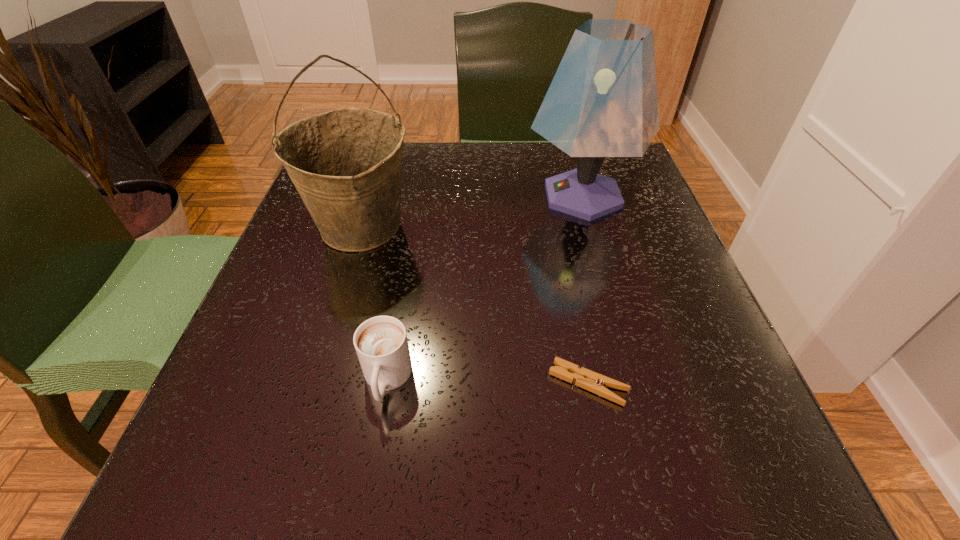
Where is `vacant area that satisfies the following two spatial constraints: 1. on the side with the handle of the clothespin; 2. on the right side of the cappuccino`? The image size is (960, 540). vacant area that satisfies the following two spatial constraints: 1. on the side with the handle of the clothespin; 2. on the right side of the cappuccino is located at coordinates (386, 383).

Identify the location of vacant point that satisfies the following two spatial constraints: 1. on the front side of the wine bucket; 2. on the right side of the clothespin. click(x=314, y=383).